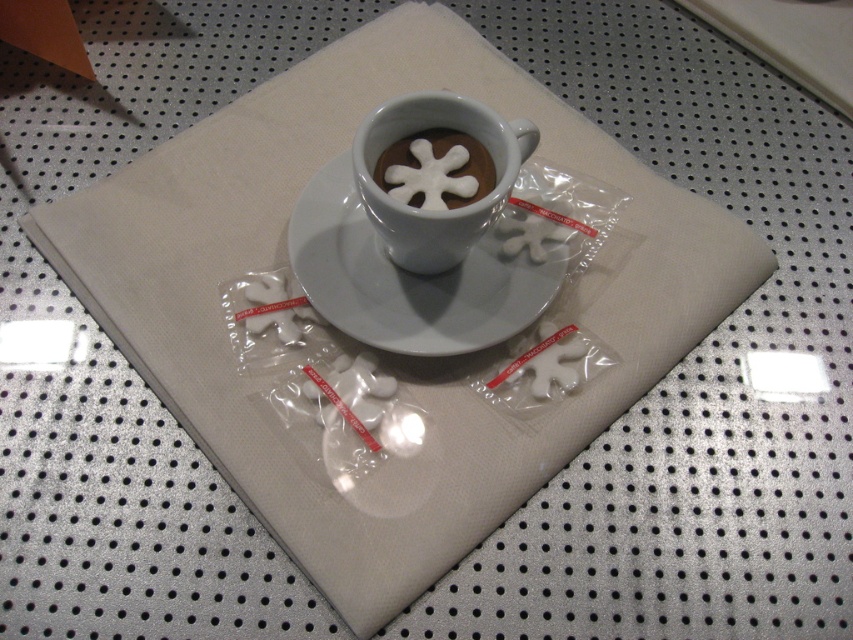
You are setting up a table for a winter themed party. You have a white glossy saucer at center and a white frothy snowflake at center. Where should you place the saucer relative to the snowflake to match the image?

The white glossy saucer at center should be placed to the left of the white frothy snowflake at center as shown in the image.

You are a barista trying to place a new snowflake decoration on top of the white glossy saucer at center. However, you notice the white frothy snowflake at center is currently blocking the saucer. Can you move the snowflake to the front of the saucer without removing it from the scene?

The white frothy snowflake at center is currently behind the white glossy saucer at center. To move it to the front, simply slide it forward so it appears in front of the saucer while keeping it on the perforated surface.